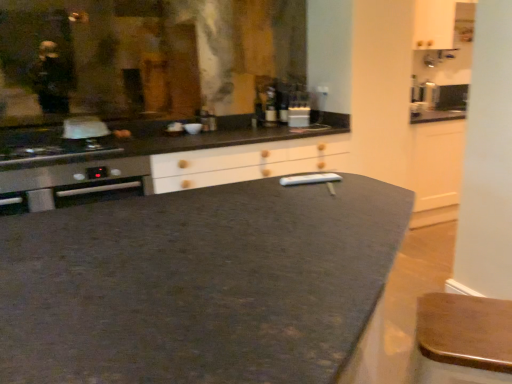
Question: In the image, is dark granite countertop at center on the left side or the right side of wooden bar stool at lower right?

Choices:
 (A) right
 (B) left

Answer: (B)

Question: Is point (158, 347) closer or farther from the camera than point (419, 380)?

Choices:
 (A) farther
 (B) closer

Answer: (B)

Question: Which is nearer to the wooden bar stool at lower right?

Choices:
 (A) stainless steel oven at left
 (B) dark granite countertop at center
 (C) matte glass bottle at center, marked as the second bottle in a right-to-left arrangement
 (D) matte glass bottle at center, the 2th bottle positioned from the left

Answer: (B)

Question: Which of these objects is positioned closest to the stainless steel oven at left?

Choices:
 (A) matte glass bottle at center, marked as the second bottle in a right-to-left arrangement
 (B) wooden bar stool at lower right
 (C) dark granite countertop at center
 (D) matte glass bottle at center, the 2th bottle positioned from the left

Answer: (A)